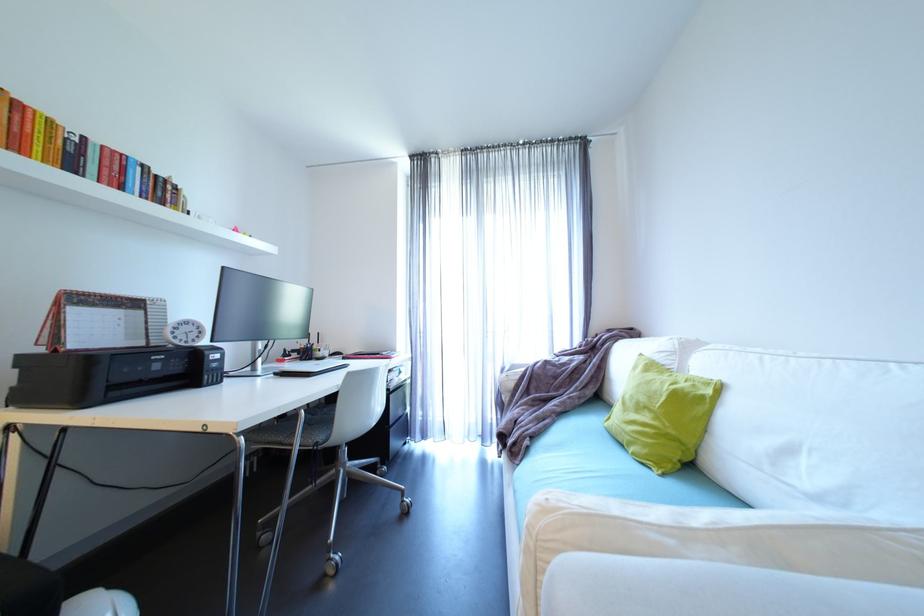
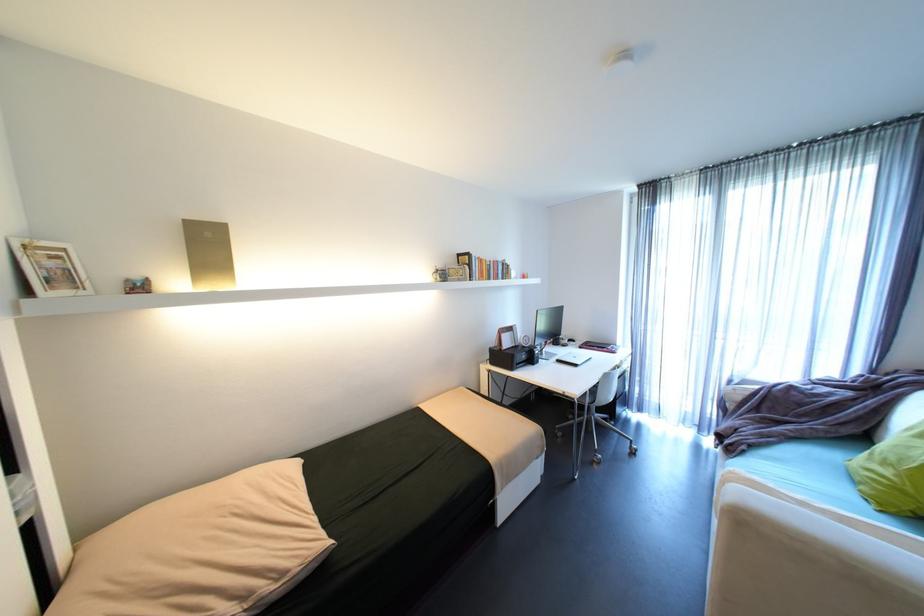
Where in the second image is the point corresponding to pixel 536 448 from the first image?

(751, 451)